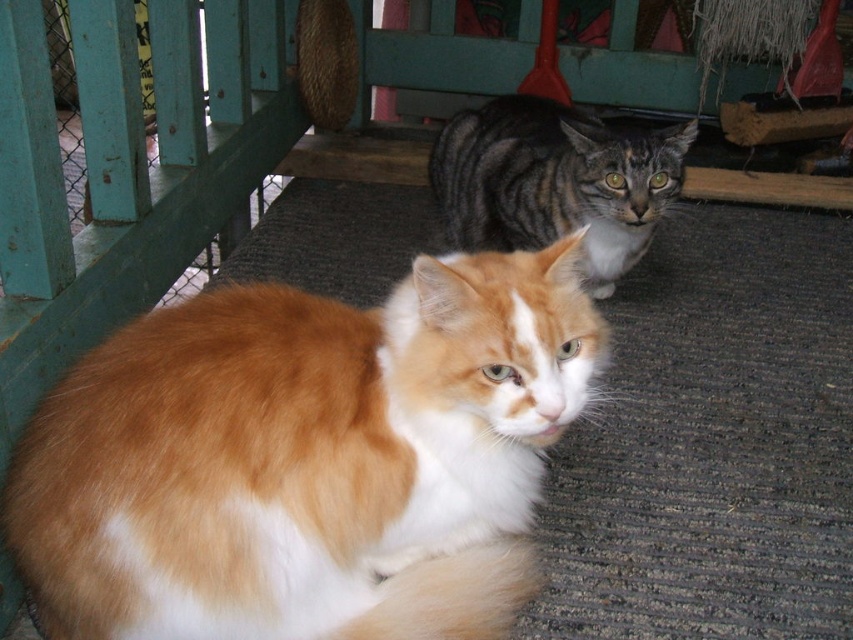
Does fluffy orange-white cat at center come behind tabby fur cat at center?

No.

Which of these two, fluffy orange-white cat at center or tabby fur cat at center, stands taller?

fluffy orange-white cat at center is taller.

The width and height of the screenshot is (853, 640). I want to click on fluffy orange-white cat at center, so click(308, 458).

Image resolution: width=853 pixels, height=640 pixels. In order to click on fluffy orange-white cat at center in this screenshot , I will do tap(308, 458).